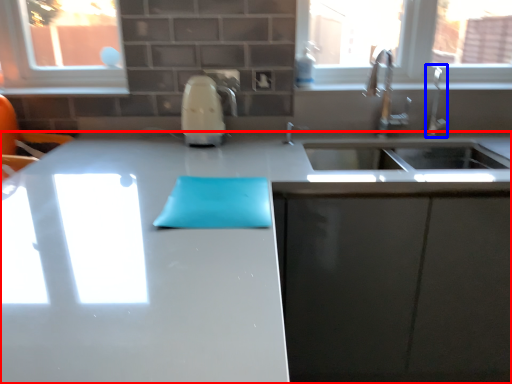
Question: Which object appears farthest to the camera in this image, countertop (highlighted by a red box) or faucet (highlighted by a blue box)?

Choices:
 (A) countertop
 (B) faucet

Answer: (B)